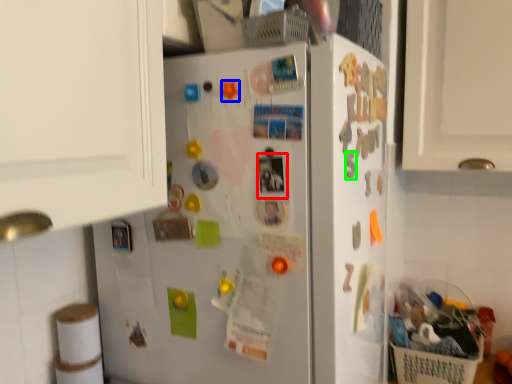
Question: Estimate the real-world distances between objects in this image. Which object is farther from button (highlighted by a red box), magnet (highlighted by a blue box) or magnet (highlighted by a green box)?

Choices:
 (A) magnet
 (B) magnet

Answer: (A)